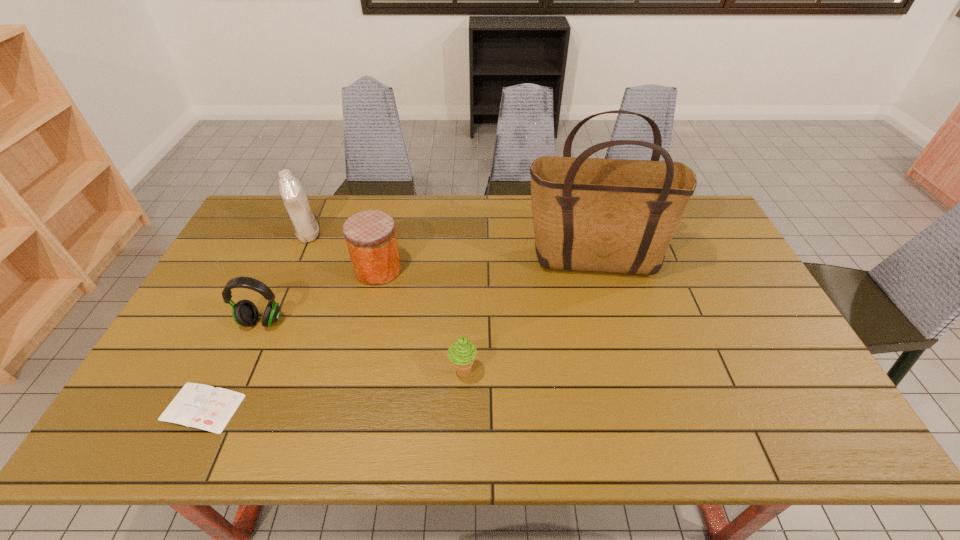
Find the location of a particular element. The image size is (960, 540). blank space at the right edge is located at coordinates (773, 388).

Find the location of a particular element. free space at the far left corner of the desktop is located at coordinates (254, 217).

Identify the location of free space at the near left corner of the desktop. (139, 418).

At what (x,y) coordinates should I click in order to perform the action: click on empty space that is in between the diary and the jar. Please return your answer as a coordinate pair (x, y). This screenshot has width=960, height=540. Looking at the image, I should click on (291, 339).

I want to click on free spot between the detergent and the headset, so click(x=285, y=278).

Find the location of a particular element. The height and width of the screenshot is (540, 960). vacant area that lies between the jar and the second object from right to left is located at coordinates (420, 320).

Locate an element on the screen. The image size is (960, 540). free space between the jar and the diary is located at coordinates (291, 339).

In order to click on free space between the jar and the headset in this screenshot , I will do `click(320, 295)`.

The width and height of the screenshot is (960, 540). I want to click on unoccupied position between the headset and the jar, so click(320, 295).

This screenshot has height=540, width=960. What are the coordinates of `free space between the second tallest object and the icecream` in the screenshot? It's located at (385, 302).